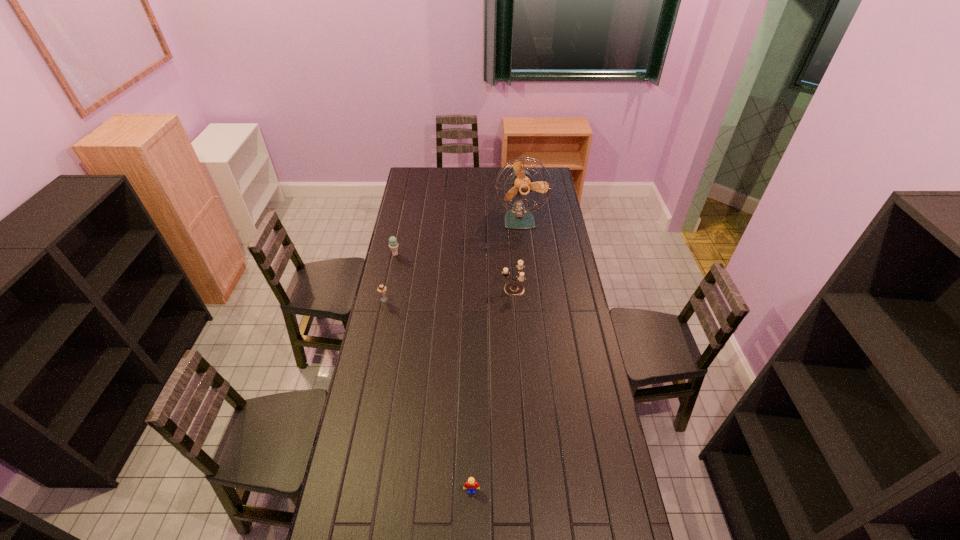
Locate an element on the screen. This screenshot has height=540, width=960. unoccupied position between the second farthest object and the nearer ice cream is located at coordinates (390, 277).

The height and width of the screenshot is (540, 960). I want to click on vacant area that lies between the fan and the fourth shortest object, so click(x=516, y=254).

Find the location of a particular element. The height and width of the screenshot is (540, 960). free space between the tallest object and the nearest object is located at coordinates (496, 355).

You are a GUI agent. You are given a task and a screenshot of the screen. Output one action in this format:
    pyautogui.click(x=<x>, y=<y>)
    Task: Click on the object that is the third nearest to the nearer ice cream
    
    Given the screenshot: What is the action you would take?
    pyautogui.click(x=518, y=217)

The width and height of the screenshot is (960, 540). I want to click on object that is the third nearest to the fan, so click(381, 289).